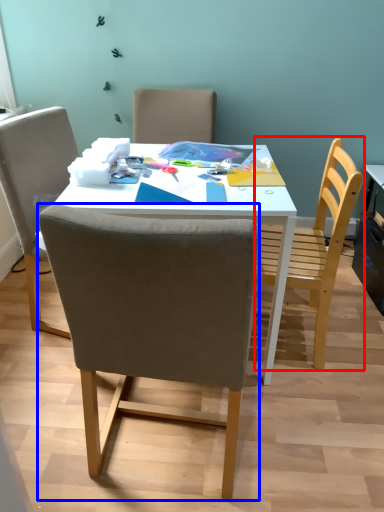
Question: Which object appears closest to the camera in this image, chair (highlighted by a red box) or chair (highlighted by a blue box)?

Choices:
 (A) chair
 (B) chair

Answer: (B)